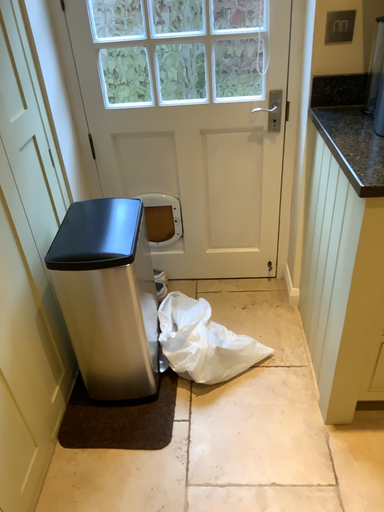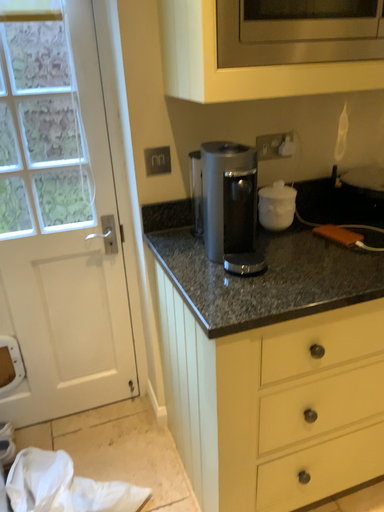
Question: Which way did the camera rotate in the video?

Choices:
 (A) rotated left
 (B) rotated right

Answer: (B)